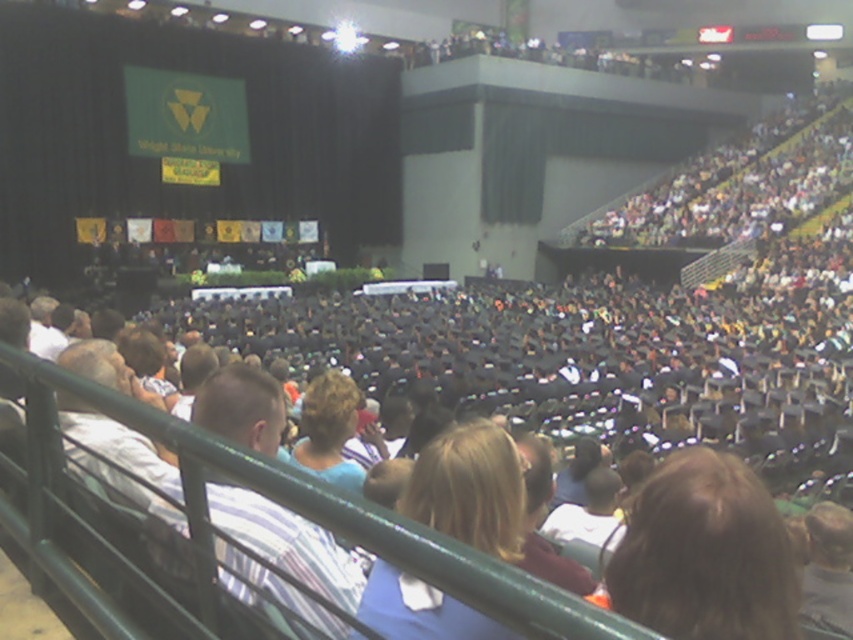
Does blonde hair at lower right have a smaller size compared to blonde hair at center?

Indeed, blonde hair at lower right has a smaller size compared to blonde hair at center.

Who is positioned more to the left, blonde hair at lower right or blonde hair at center?

blonde hair at center

Is point (685, 540) closer to viewer compared to point (490, 531)?

That is True.

The width and height of the screenshot is (853, 640). I want to click on blonde hair at lower right, so click(x=705, y=554).